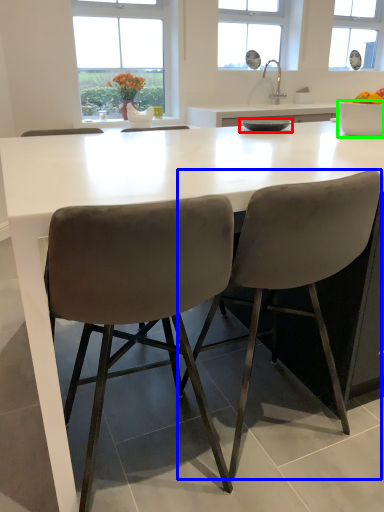
Question: Which object is positioned farthest from bowl (highlighted by a red box)? Select from chair (highlighted by a blue box) and bowl (highlighted by a green box).

Choices:
 (A) chair
 (B) bowl

Answer: (A)